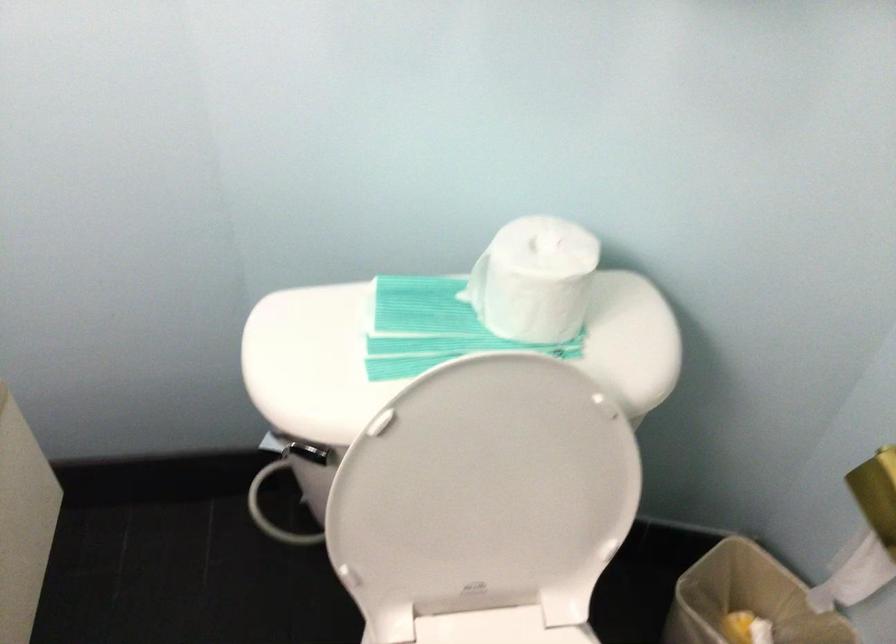
Find the location of a particular element. This screenshot has height=644, width=896. white toilet paper is located at coordinates tap(535, 279).